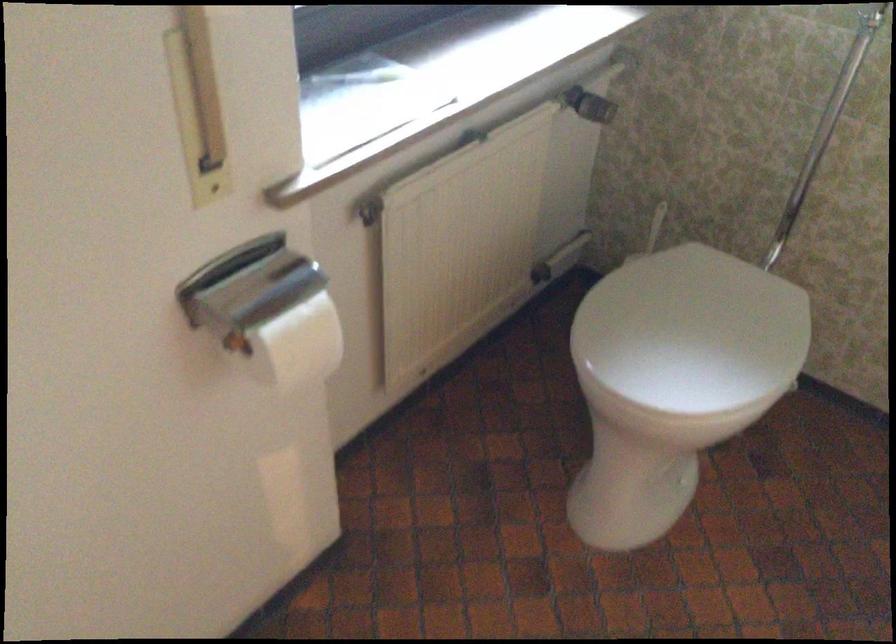
Image resolution: width=896 pixels, height=644 pixels. What do you see at coordinates (247, 285) in the screenshot? I see `the toilet paper cover` at bounding box center [247, 285].